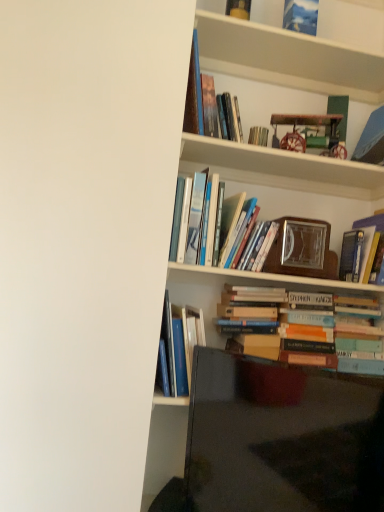
Locate an element on the screen. free point to the right of metallic silver book at upper center, the sixth book in the bottom-to-top sequence is located at coordinates (295, 164).